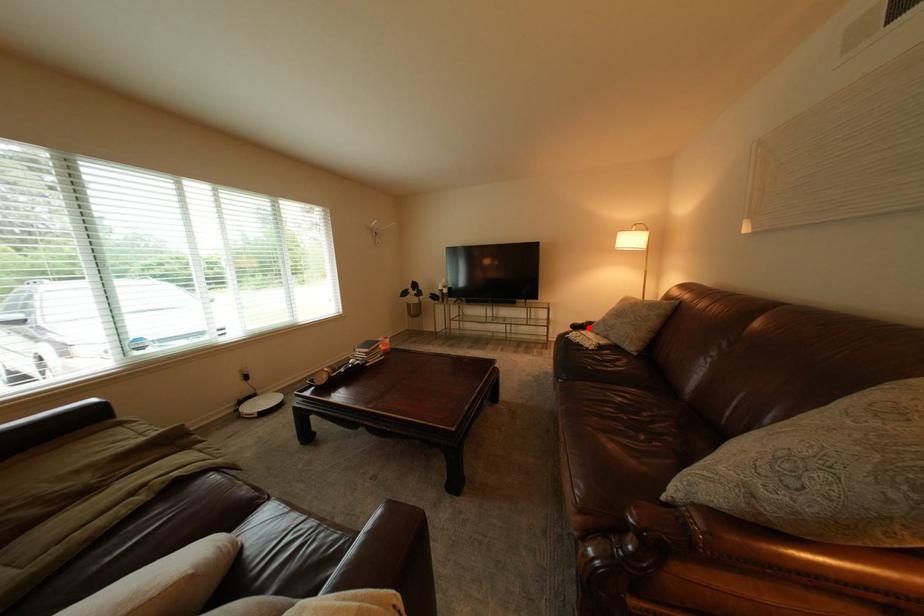
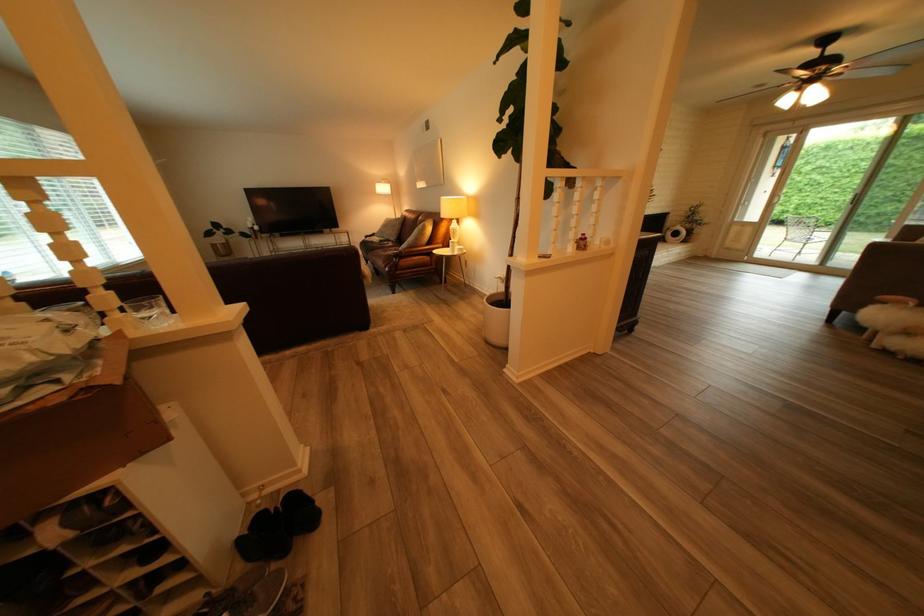
Locate, in the second image, the point that corresponds to the highlighted location in the first image.

(381, 238)